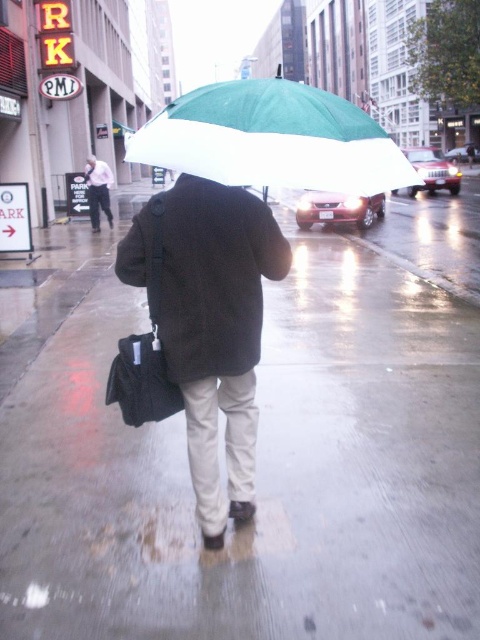
You are a pedestrian trying to cross the street in the rainy scene. You see a dark brown wool coat at center and a light pink shirt at upper left. Which one is closer to you?

The dark brown wool coat at center is closer to you because it is in front of the light pink shirt at upper left.